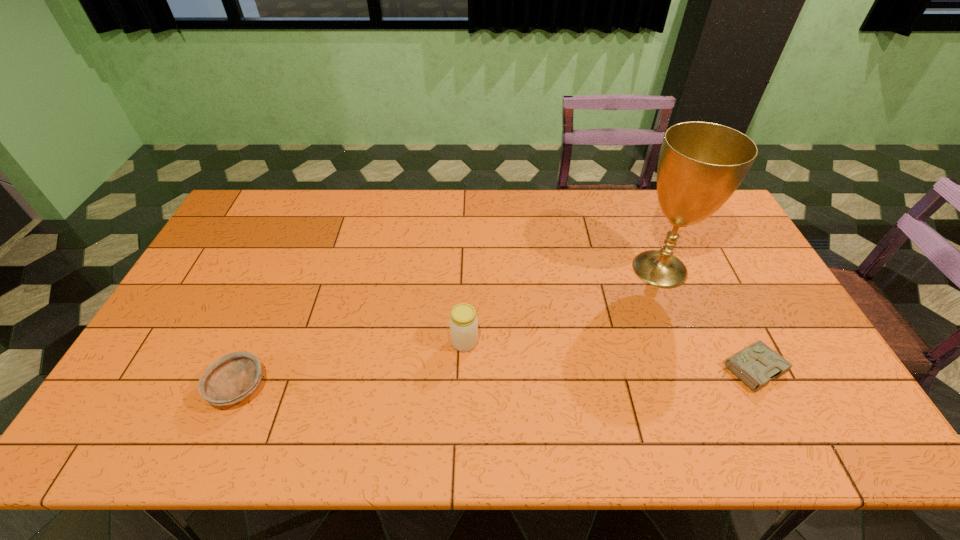
Where is `the tallest object`? This screenshot has height=540, width=960. the tallest object is located at coordinates (701, 164).

Locate an element on the screen. the farthest object is located at coordinates (701, 164).

This screenshot has height=540, width=960. In order to click on the second object from left to right in this screenshot , I will do `click(463, 323)`.

You are a GUI agent. You are given a task and a screenshot of the screen. Output one action in this format:
    pyautogui.click(x=<x>, y=<y>)
    Task: Click on the jar
    The width and height of the screenshot is (960, 540).
    Given the screenshot: What is the action you would take?
    pyautogui.click(x=463, y=323)

At what (x,y) coordinates should I click in order to perform the action: click on bowl. Please return your answer as a coordinate pair (x, y). The width and height of the screenshot is (960, 540). Looking at the image, I should click on (232, 378).

Identify the location of the third tallest object. The height and width of the screenshot is (540, 960). (232, 378).

Identify the location of diary. (757, 364).

What are the coordinates of `vacant position located 0.120m on the back of the trophy cup` in the screenshot? It's located at (641, 223).

You are a GUI agent. You are given a task and a screenshot of the screen. Output one action in this format:
    pyautogui.click(x=<x>, y=<y>)
    Task: Click on the free space located 0.100m on the right of the third object from right to left
    The width and height of the screenshot is (960, 540).
    Given the screenshot: What is the action you would take?
    pyautogui.click(x=515, y=342)

Find the location of `free spot located on the back of the bowl`. free spot located on the back of the bowl is located at coordinates (291, 266).